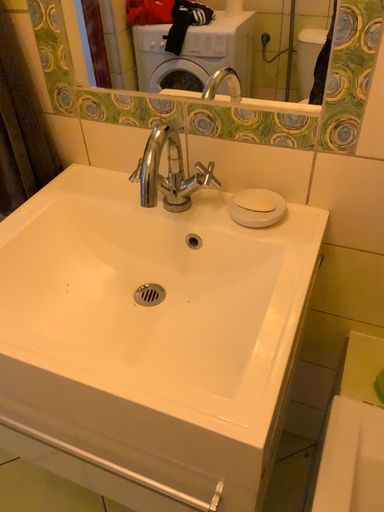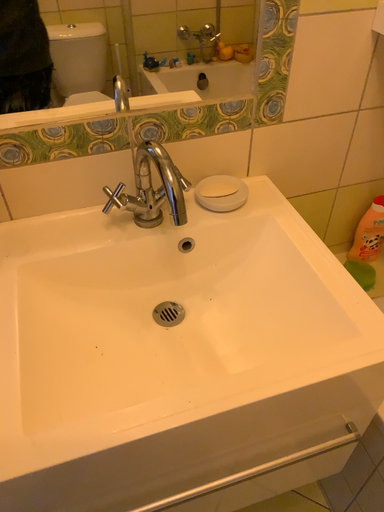
Question: How did the camera likely rotate when shooting the video?

Choices:
 (A) rotated right
 (B) rotated left

Answer: (A)